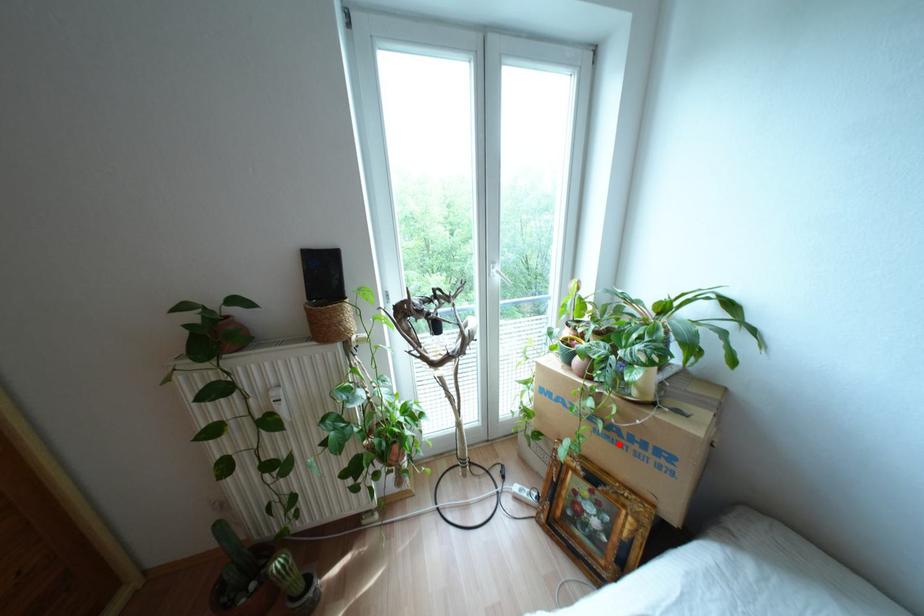
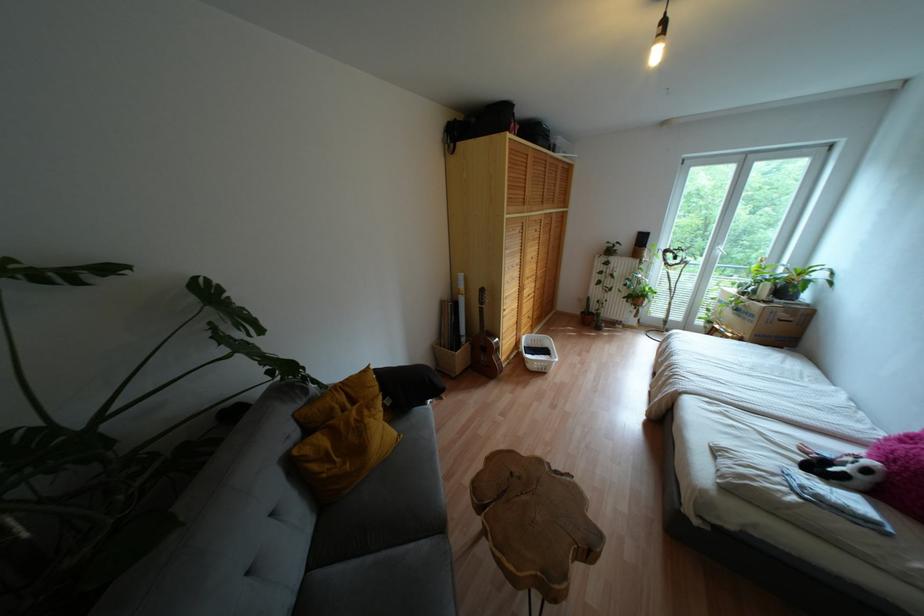
The point at the highlighted location is marked in the first image. Where is the corresponding point in the second image?

(737, 315)